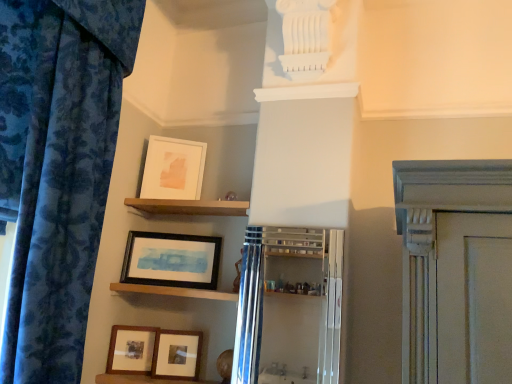
Question: Is matte black picture frame at lower left, the 2th picture frame positioned from the bottom, to the left or to the right of wooden framed picture at center, which is the third picture frame in bottom-to-top order, in the image?

Choices:
 (A) right
 (B) left

Answer: (B)

Question: Is matte black picture frame at lower left, the 2th picture frame positioned from the bottom, spatially inside wooden framed picture at center, which is the third picture frame in bottom-to-top order, or outside of it?

Choices:
 (A) inside
 (B) outside

Answer: (B)

Question: Which object is positioned closest to the wooden matte picture frame at lower center, which ranks as the fourth picture frame in top-to-bottom order?

Choices:
 (A) wooden shelf at center, which is the 1th shelf in bottom-to-top order
 (B) matte black picture frame at lower left, the 3th picture frame in the top-to-bottom sequence
 (C) matte white picture frame at upper center, the first picture frame in the top-to-bottom sequence
 (D) blue floral fabric curtain at left
 (E) clear glass cabinet at center

Answer: (B)

Question: Estimate the real-world distances between objects in this image. Which object is farther from the matte black picture frame at lower left, the 3th picture frame in the top-to-bottom sequence?

Choices:
 (A) wooden framed picture at center, arranged as the second picture frame when viewed from the top
 (B) matte white picture frame at upper center, the first picture frame in the top-to-bottom sequence
 (C) wooden matte picture frame at lower center, which ranks as the fourth picture frame in top-to-bottom order
 (D) wooden shelf at center, the 2th shelf positioned from the top
 (E) wooden shelf at upper center, arranged as the 2th shelf when ordered from the bottom

Answer: (B)